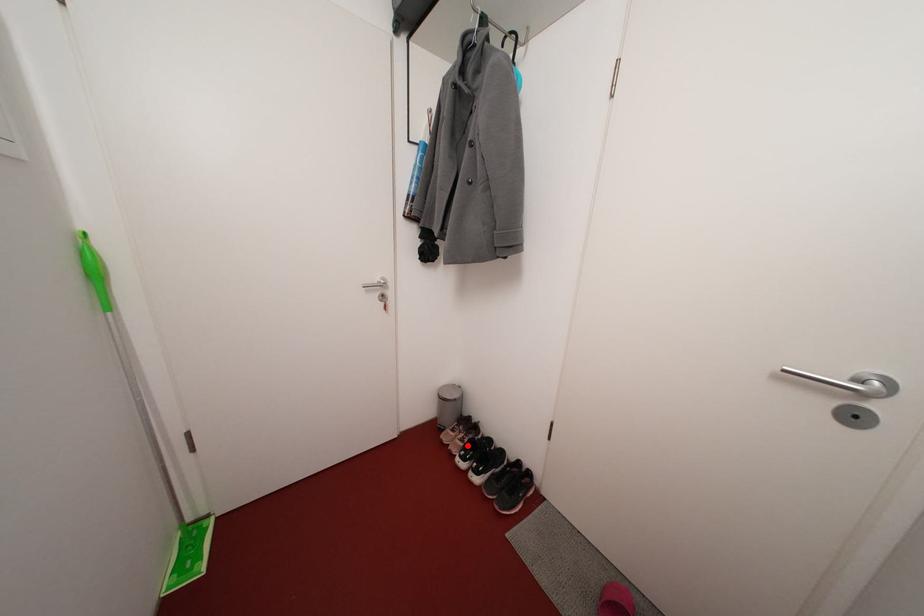
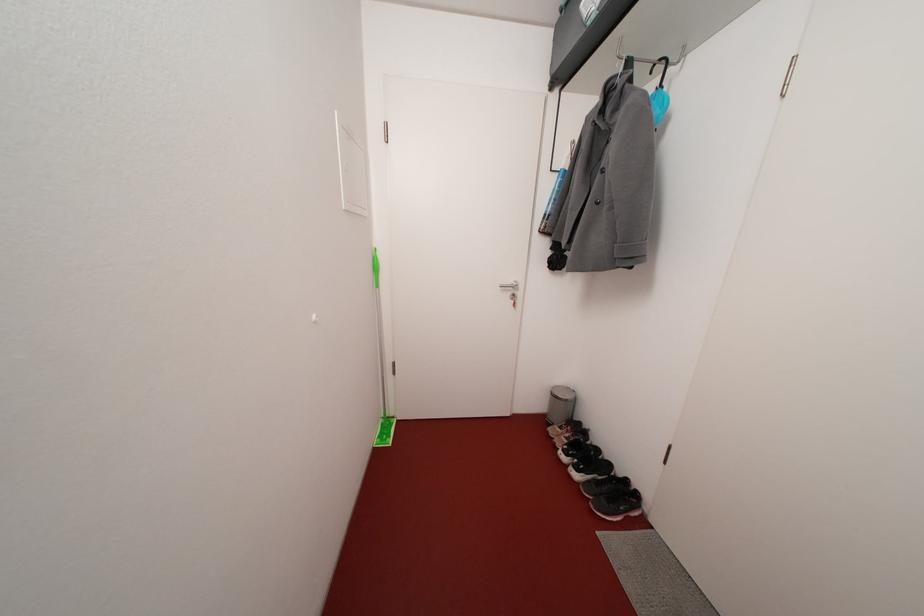
Question: A red point is marked in image1. In image2, is the corresponding 3D point closer to the camera or farther? Reply with the corresponding letter.

Choices:
 (A) The corresponding 3D point is closer.
 (B) The corresponding 3D point is farther.

Answer: (A)